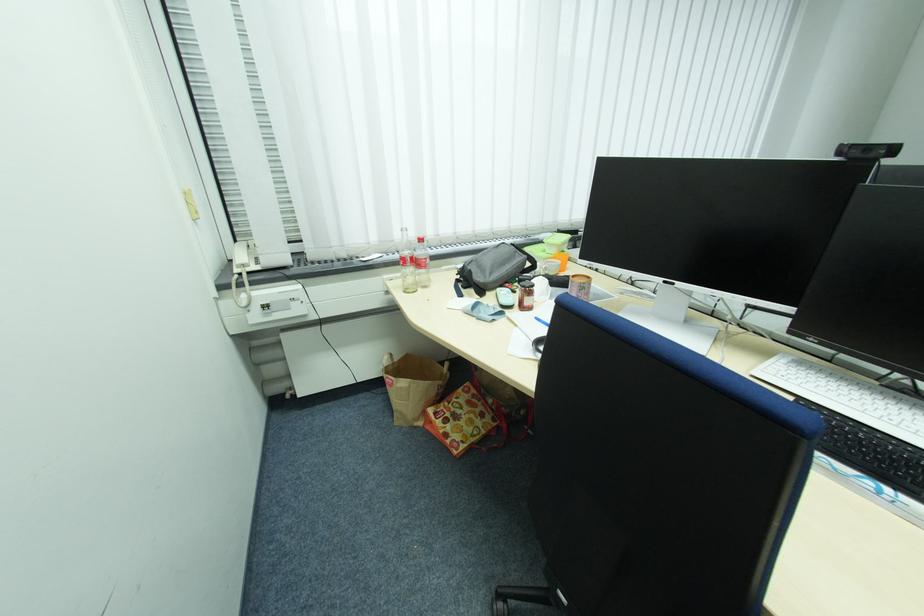
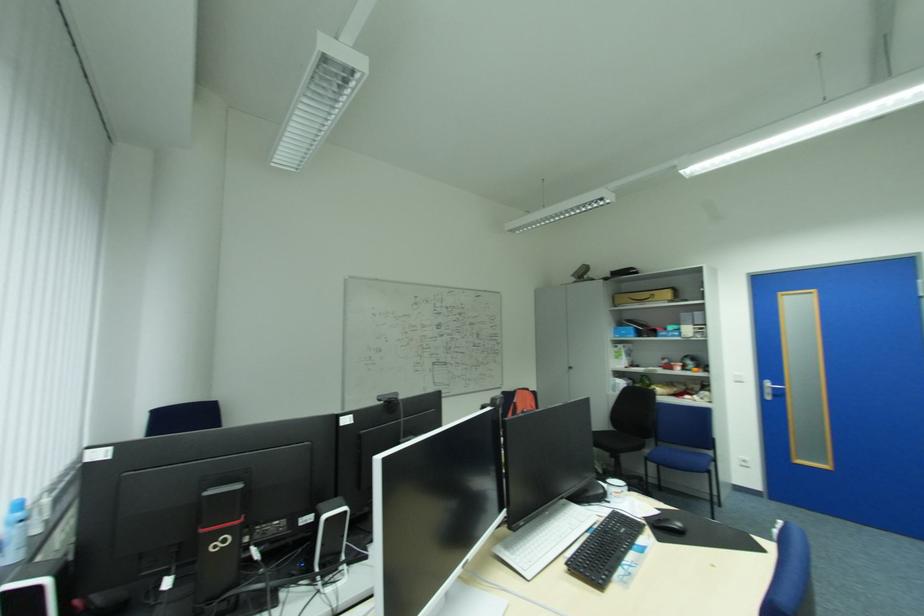
Find the pixel in the second image that matches point 807,363 in the first image.

(514, 546)